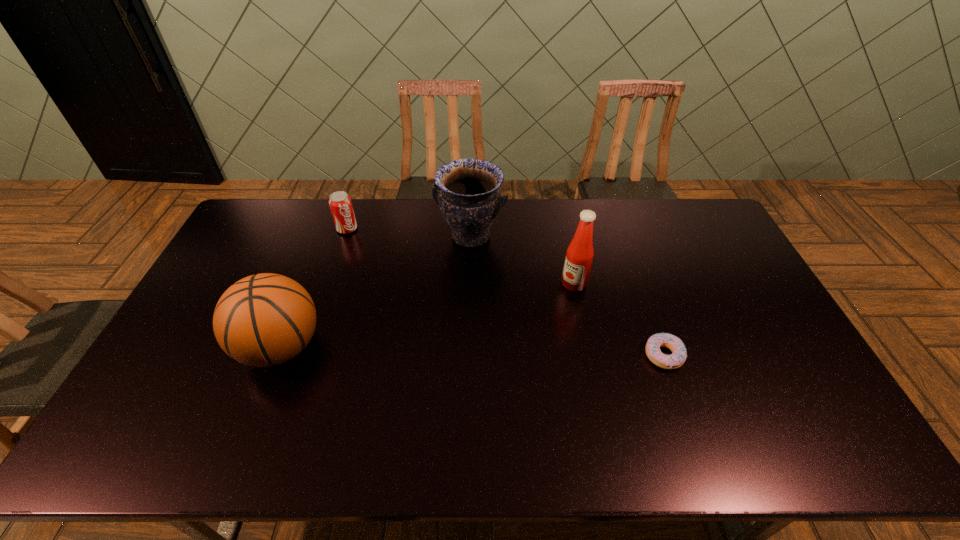
In order to click on free location located 0.050m on the front handle of the pottery in this screenshot , I will do `click(456, 266)`.

You are a GUI agent. You are given a task and a screenshot of the screen. Output one action in this format:
    pyautogui.click(x=<x>, y=<y>)
    Task: Click on the vacant space situated on the front handle of the pottery
    
    Given the screenshot: What is the action you would take?
    pyautogui.click(x=440, y=302)

Image resolution: width=960 pixels, height=540 pixels. In order to click on free space located on the logo side of the fourth tallest object in this screenshot , I will do (x=401, y=294).

What are the coordinates of `vacant space located on the logo side of the fourth tallest object` in the screenshot? It's located at (385, 275).

The width and height of the screenshot is (960, 540). I want to click on vacant space located on the logo side of the fourth tallest object, so click(401, 294).

The width and height of the screenshot is (960, 540). I want to click on free space located 0.180m on the front-facing side of the second object from right to left, so click(x=531, y=322).

Locate an element on the screen. vacant space located on the front-facing side of the second object from right to left is located at coordinates (486, 363).

Find the location of a particular element. Image resolution: width=960 pixels, height=540 pixels. vacant region located 0.250m on the front-facing side of the second object from right to left is located at coordinates (516, 336).

Locate an element on the screen. pottery at the far edge is located at coordinates (466, 190).

At what (x,y) coordinates should I click in order to perform the action: click on soda can that is at the far edge. Please return your answer as a coordinate pair (x, y). This screenshot has width=960, height=540. Looking at the image, I should click on (340, 203).